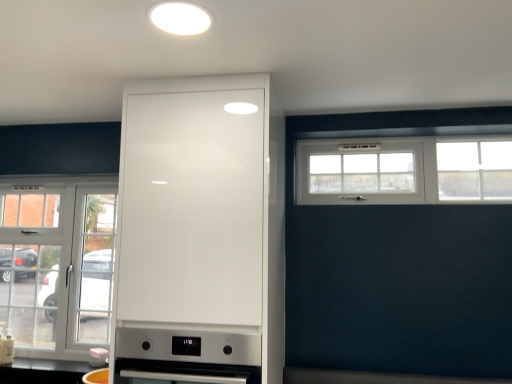
This screenshot has height=384, width=512. I want to click on vacant region above white matte light fixture at upper center (from a real-world perspective), so click(174, 13).